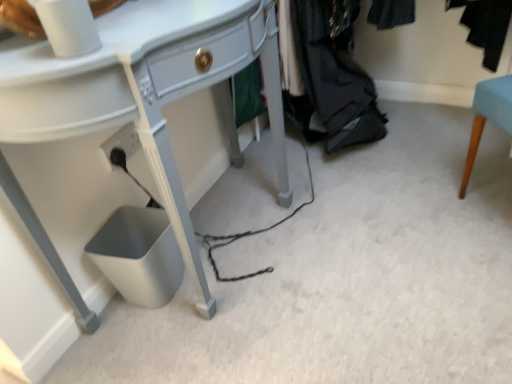
The height and width of the screenshot is (384, 512). What are the coordinates of `free location to the right of matte white desk at center` in the screenshot? It's located at (385, 232).